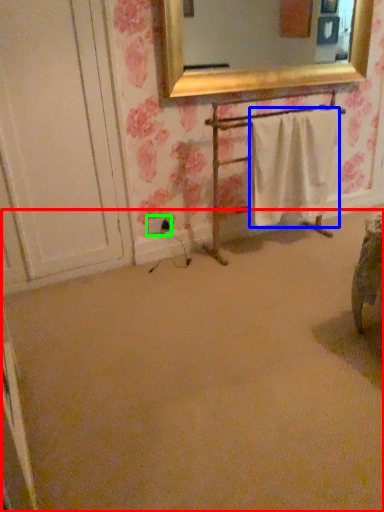
Question: Which object is positioned closest to plain (highlighted by a red box)? Select from bath towel (highlighted by a blue box) and electric outlet (highlighted by a green box).

Choices:
 (A) bath towel
 (B) electric outlet

Answer: (A)